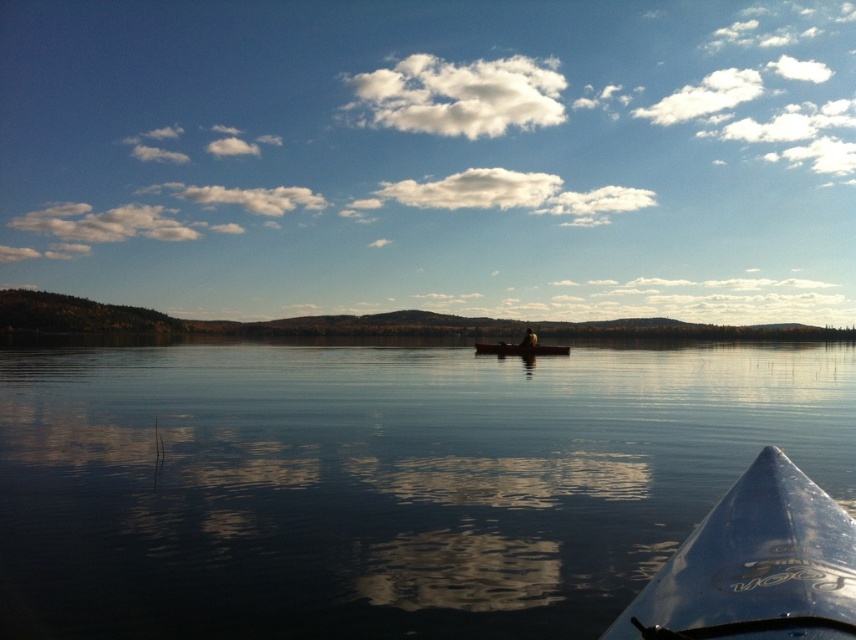
You are in a kayak and want to paddle towards the matte black canoe at center. Which direction should you turn to reach it from the transparent water at center?

Since the transparent water at center is to the left of the matte black canoe at center, you should turn to the right to paddle towards the matte black canoe at center.